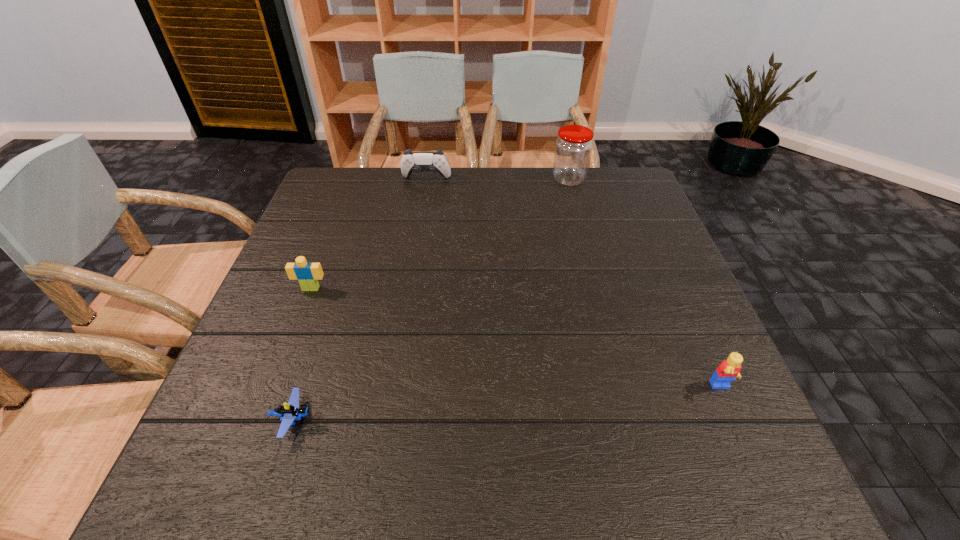
You are a GUI agent. You are given a task and a screenshot of the screen. Output one action in this format:
    pyautogui.click(x=<x>, y=<y>)
    Task: Click on the unoccupied position between the shortest object and the jar
    Image resolution: width=960 pixels, height=540 pixels.
    Given the screenshot: What is the action you would take?
    431,299

Locate an element on the screen. This screenshot has height=540, width=960. free point between the second object from right to left and the third object from left to right is located at coordinates (497, 179).

Identify the location of vacant point located between the tallest object and the third object from left to right. (497, 179).

You are a GUI agent. You are given a task and a screenshot of the screen. Output one action in this format:
    pyautogui.click(x=<x>, y=<y>)
    Task: Click on the vacant area between the fourth object from left to right and the third nearest object
    
    Given the screenshot: What is the action you would take?
    pyautogui.click(x=440, y=234)

Where is `object that is the third closest to the tallest object`? object that is the third closest to the tallest object is located at coordinates (308, 274).

Locate which object is the second closest to the farthest Lego. Please provide its 2D coordinates. Your answer should be formatted as a tuple, i.e. [(x, y)], where the tuple contains the x and y coordinates of a point satisfying the conditions above.

[(411, 161)]

Where is `the closest Lego to the farthest Lego`? This screenshot has width=960, height=540. the closest Lego to the farthest Lego is located at coordinates (291, 411).

Identify the location of the closest Lego to the shortest object. (308, 274).

At what (x,y) coordinates should I click in order to perform the action: click on free location that satisfies the following two spatial constraints: 1. on the front-facing side of the third object from right to left; 2. on the front-facing side of the shortest Lego. Please return your answer as a coordinate pair (x, y). Looking at the image, I should click on (387, 420).

You are a GUI agent. You are given a task and a screenshot of the screen. Output one action in this format:
    pyautogui.click(x=<x>, y=<y>)
    Task: Click on the vacant point that satisfies the following two spatial constraints: 1. on the face of the rightmost Lego; 2. on the front-facing side of the shortest object
    
    Given the screenshot: What is the action you would take?
    pyautogui.click(x=735, y=420)